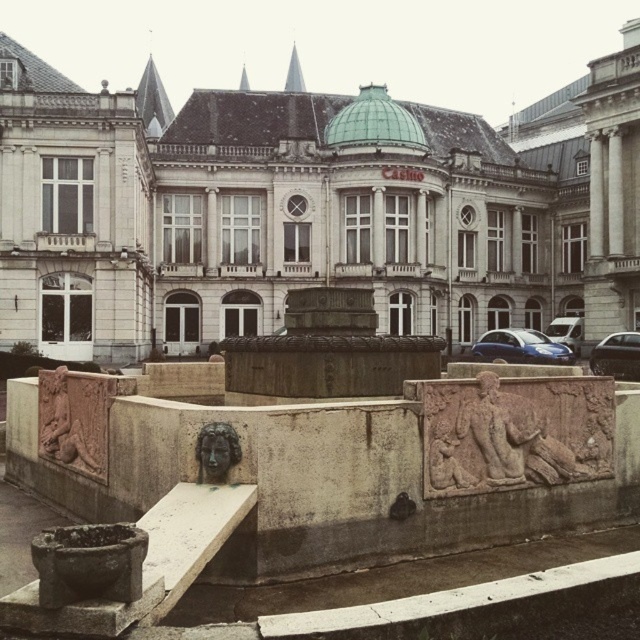
Question: Which object is the farthest from the white stone palace at center?

Choices:
 (A) metallic blue car at center
 (B) shiny black car at right

Answer: (B)

Question: Which object is the farthest from the white stone palace at center?

Choices:
 (A) metallic blue car at center
 (B) shiny black car at right
 (C) carved stone figure at lower left
 (D) bronze textured face at center

Answer: (C)

Question: Can you confirm if bronze textured face at center is wider than shiny black car at right?

Choices:
 (A) yes
 (B) no

Answer: (B)

Question: Is metallic blue car at center to the left of bronze textured face at center from the viewer's perspective?

Choices:
 (A) yes
 (B) no

Answer: (B)

Question: Is carved stone figure at lower left to the right of metallic blue car at center from the viewer's perspective?

Choices:
 (A) yes
 (B) no

Answer: (B)

Question: Which point appears farthest from the camera in this image?

Choices:
 (A) (230, 458)
 (B) (557, 400)

Answer: (B)